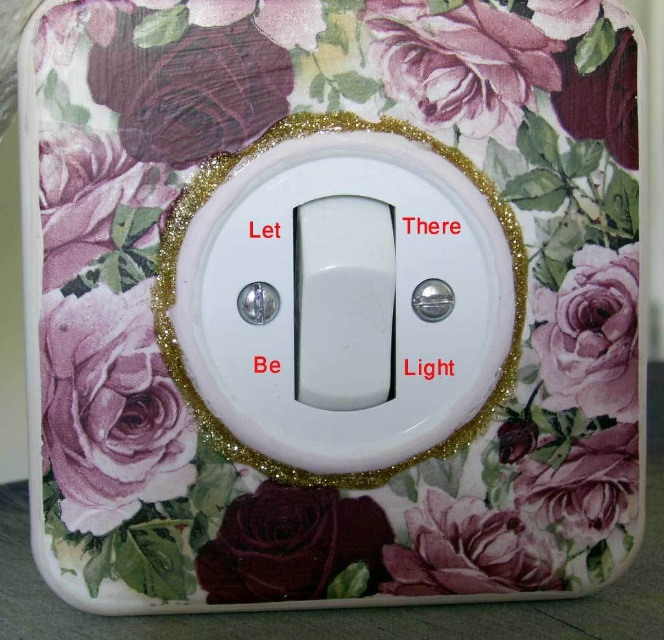
Question: Which object is farther from the camera taking this photo?

Choices:
 (A) pink glossy rose at upper right
 (B) white plastic light switch at center

Answer: (A)

Question: Is matte purple rose at lower left above matte purple fabric rose at upper left?

Choices:
 (A) yes
 (B) no

Answer: (B)

Question: Estimate the real-world distances between objects in this image. Which object is closer to the matte purple rose at lower left?

Choices:
 (A) white plastic light switch at center
 (B) matte purple fabric rose at upper left
 (C) pink glossy rose at upper right

Answer: (A)

Question: Observing the image, what is the correct spatial positioning of white plastic light switch at center in reference to pink glossy rose at upper right?

Choices:
 (A) above
 (B) below

Answer: (A)

Question: Which of these objects is positioned closest to the matte burgundy rose at lower center?

Choices:
 (A) matte purple fabric rose at upper left
 (B) pink glossy rose at upper right
 (C) matte purple rose at lower left

Answer: (C)

Question: Can you confirm if matte purple fabric rose at upper left is thinner than white plastic light switch at center?

Choices:
 (A) yes
 (B) no

Answer: (A)